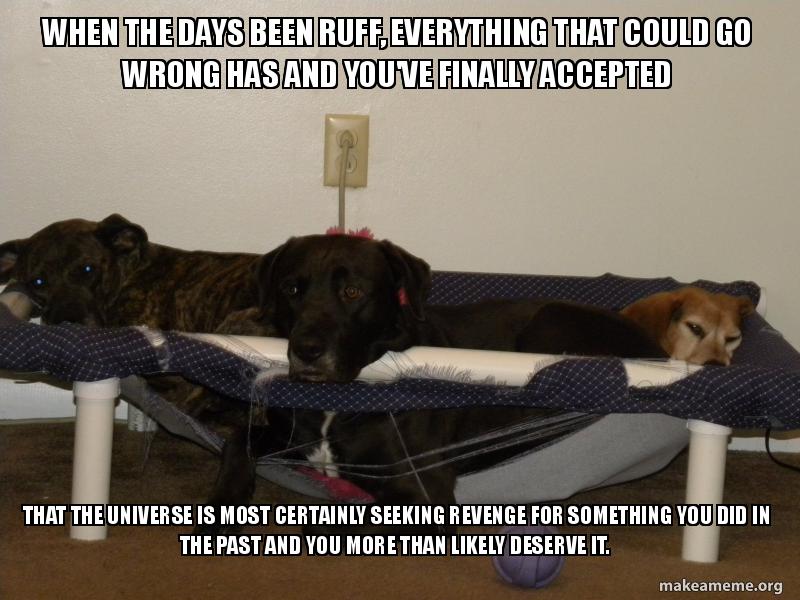
Locate an element on the screen. This screenshot has width=800, height=600. plug is located at coordinates (345, 143).